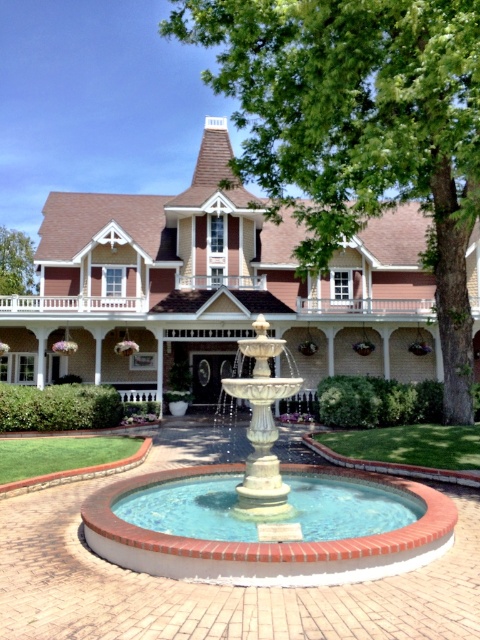
You are planning to install a new pathway between the green leafy tree at center and the green leafy tree at upper center. Given that the pathway requires a minimum of 50 feet of space to be constructed, will there be enough space between them for the pathway?

The distance between the green leafy tree at center and the green leafy tree at upper center is 88.30 feet, which is more than the required 50 feet. Therefore, there is sufficient space to construct the pathway between them.

You are standing at the front door of the house and see the point marked at coordinates [359,129]. What object does this point correspond to?

The point marked at coordinates [359,129] corresponds to the green leafy tree at center.